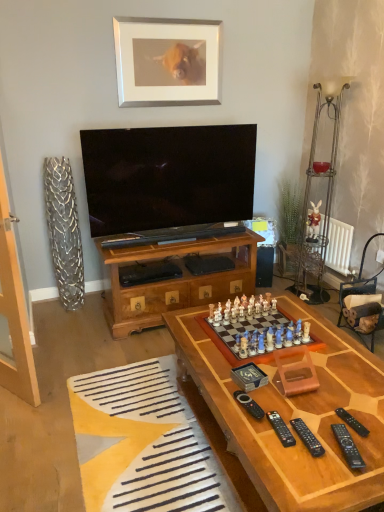
Where is `vacant area located to the right-hand side of black plastic remote at center, which ranks as the 5th remote in right-to-left order`? The image size is (384, 512). vacant area located to the right-hand side of black plastic remote at center, which ranks as the 5th remote in right-to-left order is located at coordinates (286, 407).